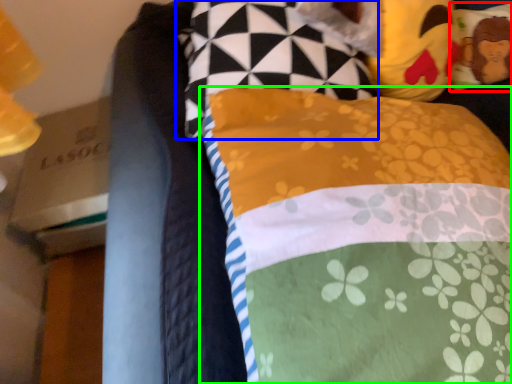
Question: Considering the real-world distances, which object is closest to pillow (highlighted by a red box)? pillow (highlighted by a blue box) or pillow (highlighted by a green box).

Choices:
 (A) pillow
 (B) pillow

Answer: (A)